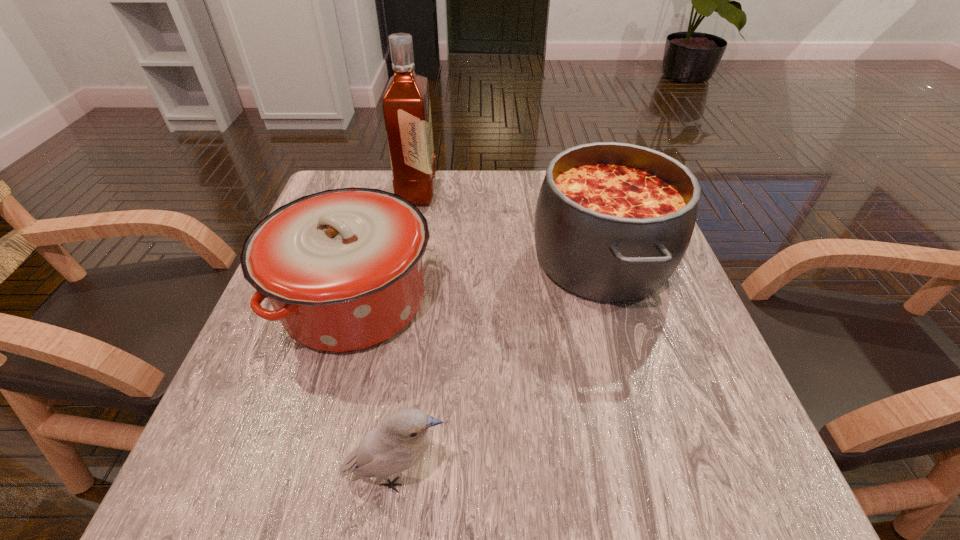
This screenshot has width=960, height=540. I want to click on vacant area in the image that satisfies the following two spatial constraints: 1. on the front label of the rightmost object; 2. on the right side of the liquor, so click(x=405, y=260).